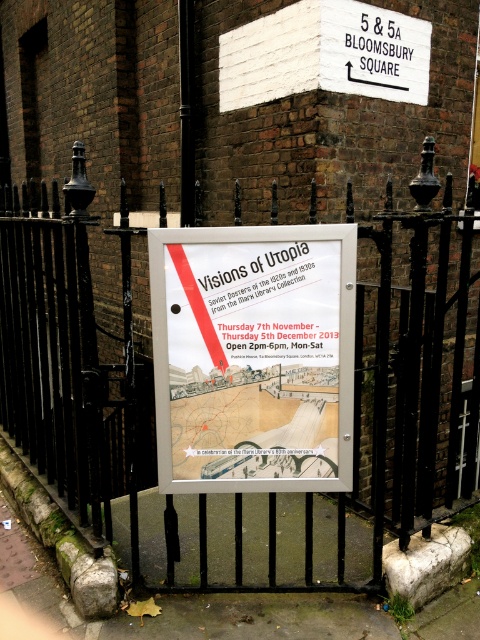
What is the significance of the point marked at coordinates (242,371) in the image?

The point marked at coordinates (242,371) indicates the location of the black metal fence at center in the image.

What is the relationship between the sizes of the black metal fence at center and the white paper poster at center in the scene?

The black metal fence at center is larger in size compared to the white paper poster at center.

In the scene shown: You are a delivery person trying to attach a new poster to the fence. The new poster is the same size as the existing white paper poster at center. Will the black metal fence at center have enough space to accommodate the new poster without overlapping?

The black metal fence at center has a larger width than the white paper poster at center, so there will be enough space to attach the new poster without overlapping.